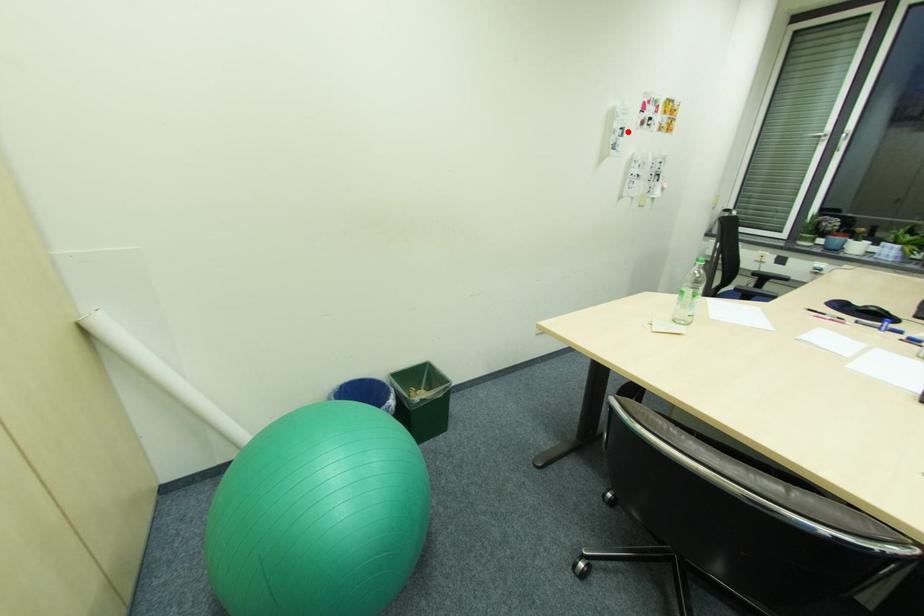
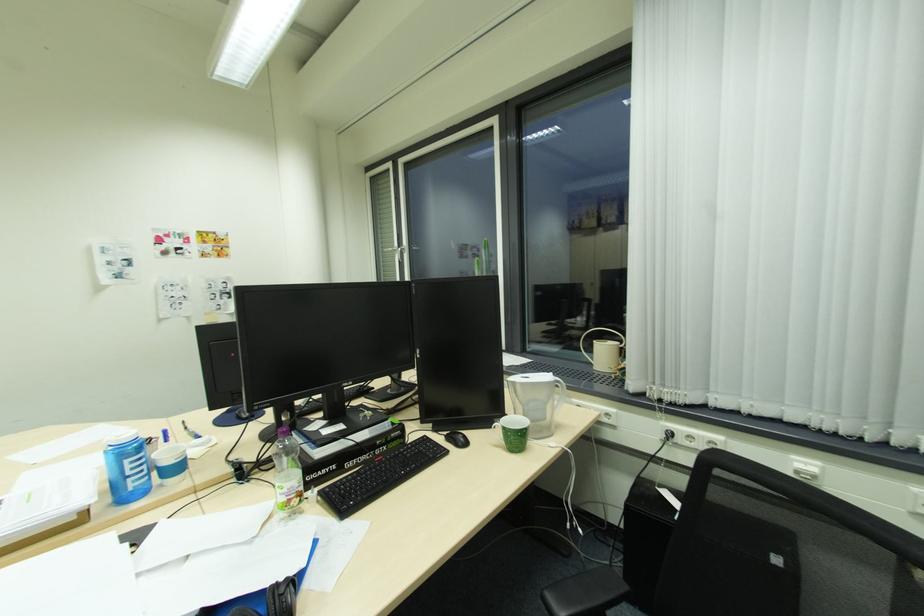
In the second image, find the point that corresponds to the highlighted location in the first image.

(131, 262)